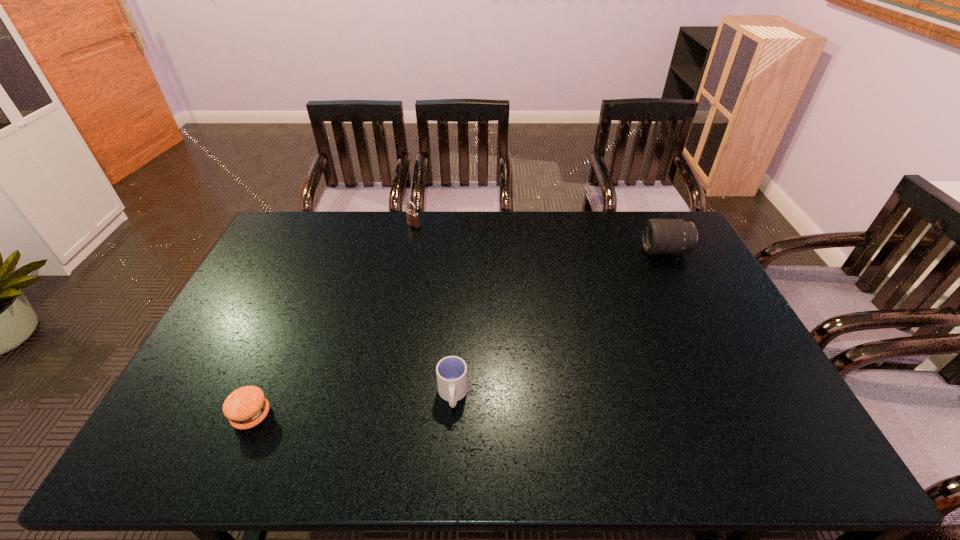
You are a GUI agent. You are given a task and a screenshot of the screen. Output one action in this format:
    pyautogui.click(x=<x>, y=<y>)
    Task: Click on the vacant region that satisfies the following two spatial constraints: 1. on the surface of the third nearest object; 2. with the handle on the side of the second shortest object
    The image size is (960, 540).
    Given the screenshot: What is the action you would take?
    pyautogui.click(x=737, y=395)

This screenshot has height=540, width=960. Find the location of `free space in the image that satisfies the following two spatial constraints: 1. on the back side of the leftmost object; 2. on the right side of the padlock`. free space in the image that satisfies the following two spatial constraints: 1. on the back side of the leftmost object; 2. on the right side of the padlock is located at coordinates (332, 226).

Where is `vacant space that satisfies the following two spatial constraints: 1. on the back side of the farthest object; 2. on the left side of the patty`? This screenshot has height=540, width=960. vacant space that satisfies the following two spatial constraints: 1. on the back side of the farthest object; 2. on the left side of the patty is located at coordinates pyautogui.click(x=332, y=226).

You are a GUI agent. You are given a task and a screenshot of the screen. Output one action in this format:
    pyautogui.click(x=<x>, y=<y>)
    Task: Click on the vacant space that satisfies the following two spatial constraints: 1. on the surface of the second farthest object; 2. with the handle on the side of the cup
    
    Given the screenshot: What is the action you would take?
    pyautogui.click(x=737, y=395)